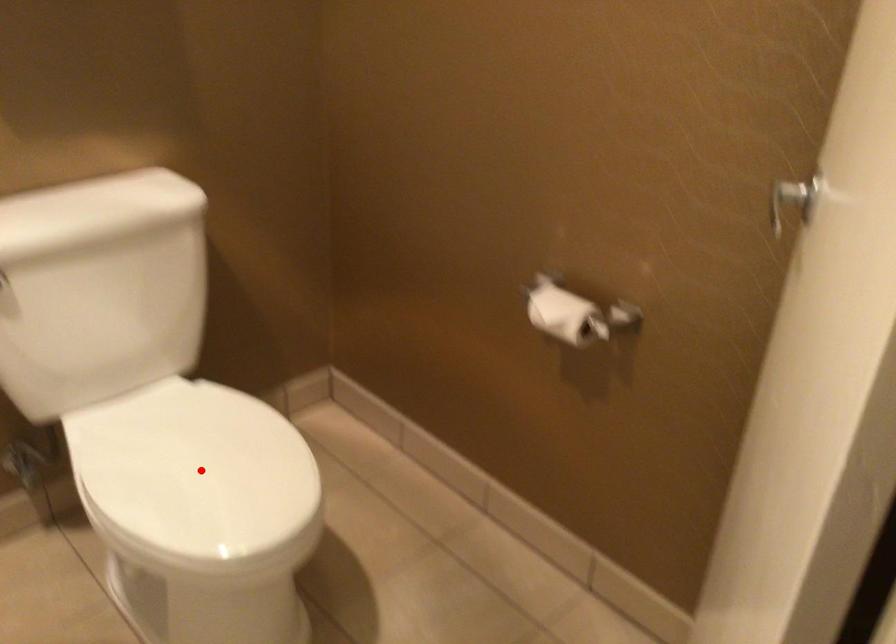
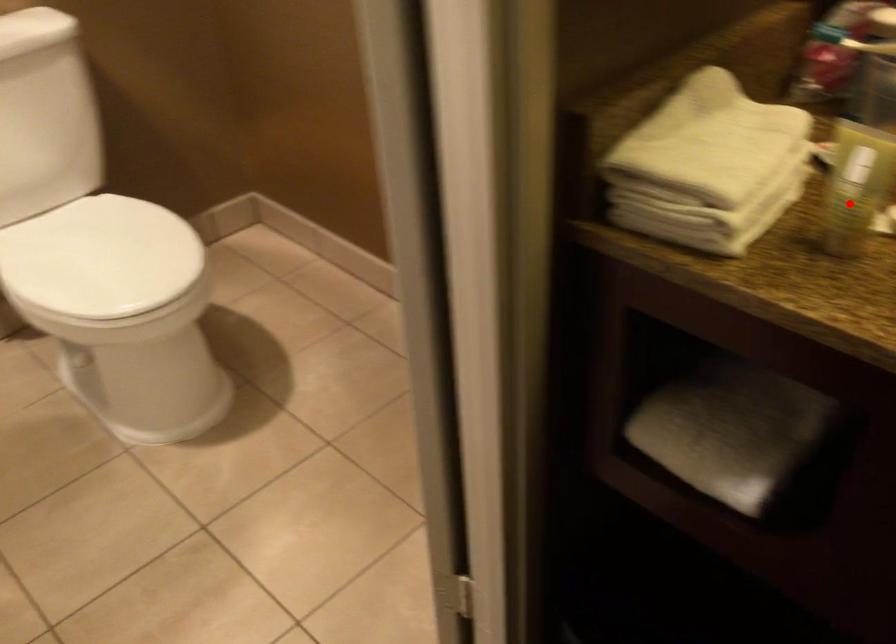
I am providing you with two images of the same scene from different viewpoints. A red point is marked on the first image and another point is marked on the second image. Is the red point in image1 aligned with the point shown in image2?

No